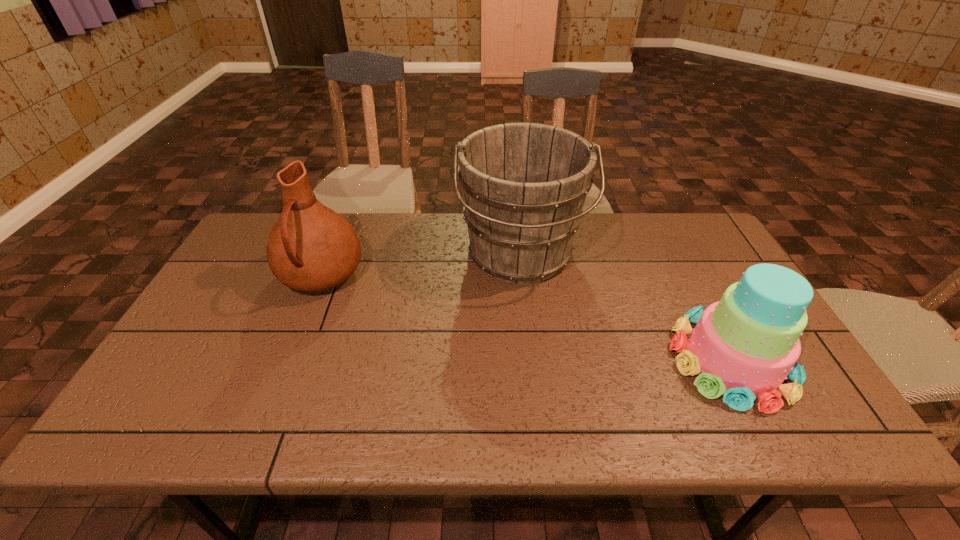
Locate an element on the screen. This screenshot has height=540, width=960. object that is at the right edge is located at coordinates point(744,346).

Find the location of `object that is at the near right corner`. object that is at the near right corner is located at coordinates (744, 346).

Locate an element on the screen. This screenshot has width=960, height=540. vacant area at the far edge of the desktop is located at coordinates (345, 217).

This screenshot has width=960, height=540. In the image, there is a desktop. Identify the location of vacant space at the near edge. (591, 409).

Identify the location of free space at the left edge of the desktop. The height and width of the screenshot is (540, 960). (184, 340).

Find the location of `vacant space at the far right corner of the desktop`. vacant space at the far right corner of the desktop is located at coordinates point(660,228).

You are a GUI agent. You are given a task and a screenshot of the screen. Output one action in this format:
    pyautogui.click(x=<x>, y=<y>)
    Task: Click on the free space that is in between the leftmost object and the rightmost object
    This screenshot has width=960, height=540.
    Given the screenshot: What is the action you would take?
    pyautogui.click(x=526, y=318)

Identify the location of unoccupied area between the pitcher and the shortest object. The width and height of the screenshot is (960, 540). (526, 318).

Image resolution: width=960 pixels, height=540 pixels. Find the location of `empty space that is in between the pitcher and the bucket`. empty space that is in between the pitcher and the bucket is located at coordinates (420, 265).

In order to click on empty space between the rightmost object and the second object from left to right in this screenshot , I will do `click(626, 307)`.